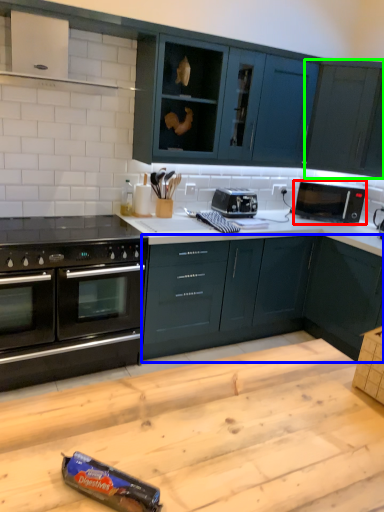
Question: Estimate the real-world distances between objects in this image. Which object is farther from microwave oven (highlighted by a red box), cabinetry (highlighted by a blue box) or cabinetry (highlighted by a green box)?

Choices:
 (A) cabinetry
 (B) cabinetry

Answer: (A)